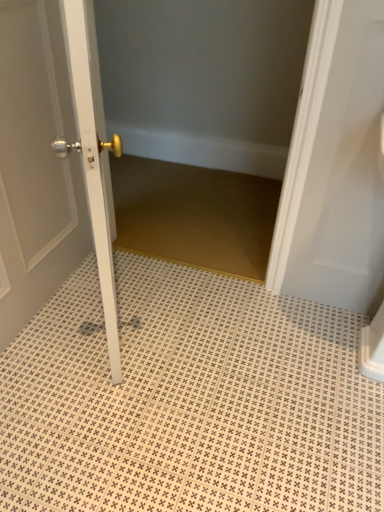
Question: Does white textured tile at center have a lesser width compared to white glossy door at center?

Choices:
 (A) yes
 (B) no

Answer: (B)

Question: Is white glossy door at center at the back of white textured tile at center?

Choices:
 (A) no
 (B) yes

Answer: (A)

Question: Considering the relative sizes of white textured tile at center and white glossy door at center in the image provided, is white textured tile at center wider than white glossy door at center?

Choices:
 (A) yes
 (B) no

Answer: (A)

Question: Does white textured tile at center have a lesser height compared to white glossy door at center?

Choices:
 (A) no
 (B) yes

Answer: (B)

Question: Is white textured tile at center positioned before white glossy door at center?

Choices:
 (A) yes
 (B) no

Answer: (B)

Question: Is white textured tile at center positioned behind white glossy door at center?

Choices:
 (A) no
 (B) yes

Answer: (B)

Question: Can we say white glossy door at center lies outside white textured tile at center?

Choices:
 (A) no
 (B) yes

Answer: (B)

Question: Does white glossy door at center come behind white textured tile at center?

Choices:
 (A) no
 (B) yes

Answer: (A)

Question: Is white glossy door at center facing towards white textured tile at center?

Choices:
 (A) yes
 (B) no

Answer: (A)

Question: From a real-world perspective, is white glossy door at center positioned over white textured tile at center based on gravity?

Choices:
 (A) no
 (B) yes

Answer: (B)

Question: Is white glossy door at center positioned with its back to white textured tile at center?

Choices:
 (A) no
 (B) yes

Answer: (A)

Question: Does white glossy door at center have a lesser width compared to white textured tile at center?

Choices:
 (A) yes
 (B) no

Answer: (A)

Question: Is white textured tile at center taller or shorter than white glossy door at center?

Choices:
 (A) tall
 (B) short

Answer: (B)